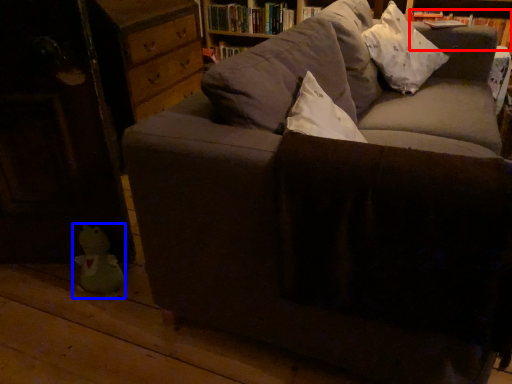
Question: Among these objects, which one is nearest to the camera, book (highlighted by a red box) or toy (highlighted by a blue box)?

Choices:
 (A) book
 (B) toy

Answer: (B)